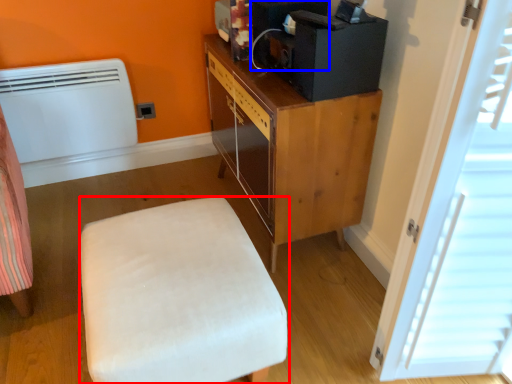
Question: Which object appears farthest to the camera in this image, furniture (highlighted by a red box) or appliance (highlighted by a blue box)?

Choices:
 (A) furniture
 (B) appliance

Answer: (B)